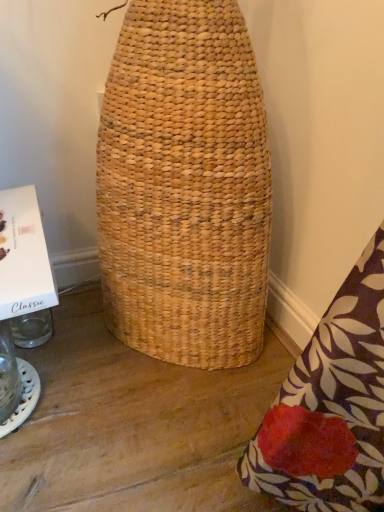
Question: Would you say white cardboard box at left is inside or outside transparent glass jar at lower left?

Choices:
 (A) inside
 (B) outside

Answer: (B)

Question: Considering the positions of white cardboard box at left and transparent glass jar at lower left in the image, is white cardboard box at left wider or thinner than transparent glass jar at lower left?

Choices:
 (A) wide
 (B) thin

Answer: (A)

Question: From the image's perspective, is white cardboard box at left above or below transparent glass jar at lower left?

Choices:
 (A) above
 (B) below

Answer: (A)

Question: Is transparent glass jar at lower left wider or thinner than white cardboard box at left?

Choices:
 (A) thin
 (B) wide

Answer: (A)

Question: In the image, is transparent glass jar at lower left positioned in front of or behind white cardboard box at left?

Choices:
 (A) behind
 (B) front

Answer: (A)

Question: Does point (6, 366) appear closer or farther from the camera than point (6, 292)?

Choices:
 (A) farther
 (B) closer

Answer: (A)

Question: Is transparent glass jar at lower left inside or outside of white cardboard box at left?

Choices:
 (A) outside
 (B) inside

Answer: (A)